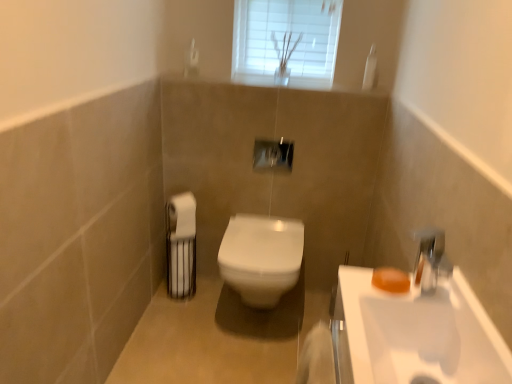
Question: Would you say chrome metallic faucet at upper right is part of white matte toilet paper at left's contents?

Choices:
 (A) yes
 (B) no

Answer: (B)

Question: Does white matte toilet paper at left have a smaller size compared to chrome metallic faucet at upper right?

Choices:
 (A) no
 (B) yes

Answer: (A)

Question: Does white matte toilet paper at left have a greater width compared to chrome metallic faucet at upper right?

Choices:
 (A) no
 (B) yes

Answer: (B)

Question: Is white matte toilet paper at left oriented away from chrome metallic faucet at upper right?

Choices:
 (A) yes
 (B) no

Answer: (B)

Question: Is white matte toilet paper at left at the right side of chrome metallic faucet at upper right?

Choices:
 (A) yes
 (B) no

Answer: (B)

Question: Does white matte toilet paper at left have a lesser width compared to chrome metallic faucet at upper right?

Choices:
 (A) no
 (B) yes

Answer: (A)

Question: Can we say white glossy sink at lower right lies outside orange matte soap at right?

Choices:
 (A) no
 (B) yes

Answer: (B)

Question: Does white glossy sink at lower right have a lesser height compared to orange matte soap at right?

Choices:
 (A) no
 (B) yes

Answer: (A)

Question: Could you tell me if white glossy sink at lower right is facing orange matte soap at right?

Choices:
 (A) yes
 (B) no

Answer: (B)

Question: Are white glossy sink at lower right and orange matte soap at right making contact?

Choices:
 (A) no
 (B) yes

Answer: (A)

Question: Could orange matte soap at right be considered to be inside white glossy sink at lower right?

Choices:
 (A) no
 (B) yes

Answer: (B)

Question: From a real-world perspective, is white glossy sink at lower right positioned under orange matte soap at right based on gravity?

Choices:
 (A) yes
 (B) no

Answer: (A)

Question: Is white glass window at upper center at the right side of white glossy sink at lower right?

Choices:
 (A) no
 (B) yes

Answer: (A)